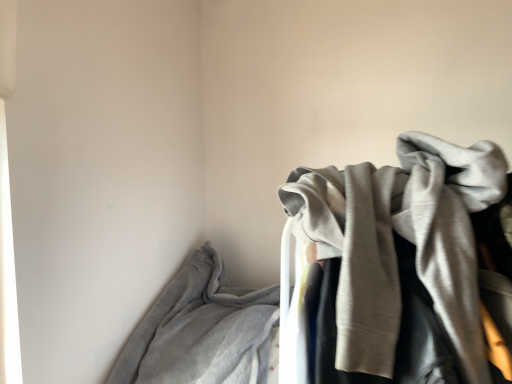
I want to click on soft gray blanket at lower left, so click(x=201, y=330).

What is the approximate width of soft gray blanket at lower left?

27.71 inches.

Measure the distance between soft gray blanket at lower left and camera.

soft gray blanket at lower left is 1.00 meters away from camera.

Describe the element at coordinates (201, 330) in the screenshot. I see `soft gray blanket at lower left` at that location.

Identify the location of soft gray blanket at lower left. (201, 330).